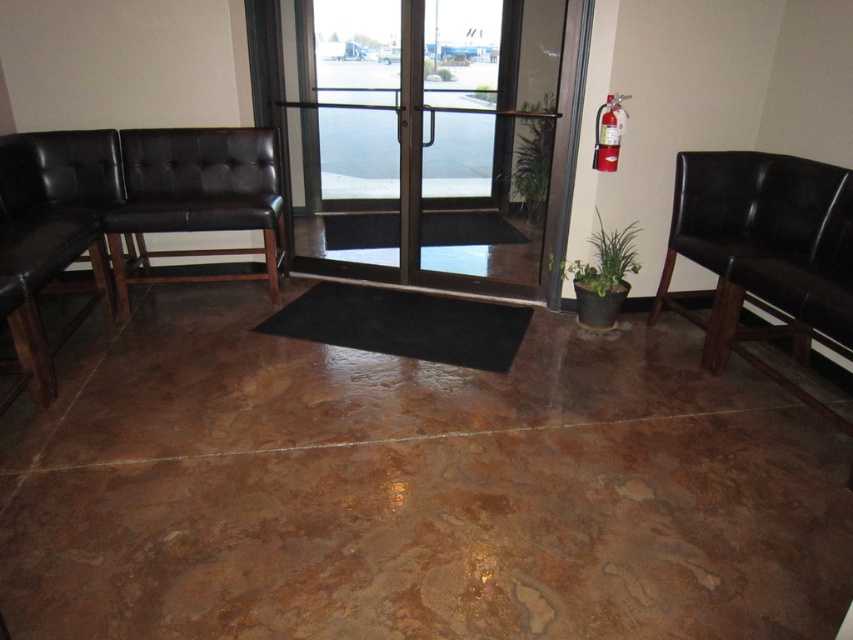
Question: Which point is closer to the camera?

Choices:
 (A) (113, 211)
 (B) (318, 339)

Answer: (B)

Question: Which point appears farthest from the camera in this image?

Choices:
 (A) (805, 314)
 (B) (521, 35)
 (C) (239, 134)

Answer: (B)

Question: Which point is farther to the camera?

Choices:
 (A) matte black bench at left
 (B) clear glass door at center

Answer: (A)

Question: Is clear glass door at center in front of black rubber mat at center?

Choices:
 (A) no
 (B) yes

Answer: (A)

Question: Is matte black bench at left closer to camera compared to black rubber mat at center?

Choices:
 (A) yes
 (B) no

Answer: (B)

Question: Does clear glass door at center have a smaller size compared to matte black bench at left?

Choices:
 (A) yes
 (B) no

Answer: (B)